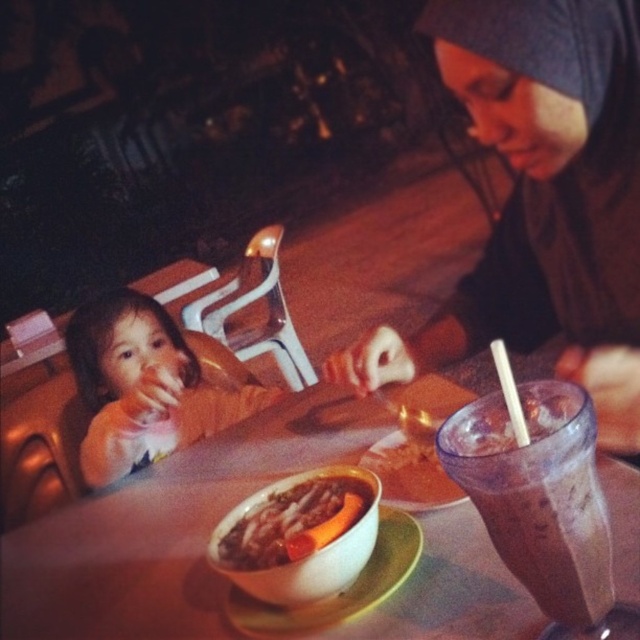
Image resolution: width=640 pixels, height=640 pixels. I want to click on chocolate milkshake at right, so 538,493.

Who is positioned more to the left, chocolate milkshake at right or smooth orange carrot at center?

smooth orange carrot at center is more to the left.

At what (x,y) coordinates should I click in order to perform the action: click on chocolate milkshake at right. Please return your answer as a coordinate pair (x, y). Looking at the image, I should click on (538, 493).

Can you confirm if smooth wooden table at center is taller than chocolate milkshake at right?

Correct, smooth wooden table at center is much taller as chocolate milkshake at right.

Does smooth wooden table at center appear over chocolate milkshake at right?

Incorrect, smooth wooden table at center is not positioned above chocolate milkshake at right.

You are a GUI agent. You are given a task and a screenshot of the screen. Output one action in this format:
    pyautogui.click(x=<x>, y=<y>)
    Task: Click on the smooth wooden table at center
    
    Given the screenshot: What is the action you would take?
    pyautogui.click(x=168, y=529)

Where is `smooth wooden table at center`? smooth wooden table at center is located at coordinates (168, 529).

Does chocolate milkshake at right appear on the right side of smooth beige shirt at left?

Yes, chocolate milkshake at right is to the right of smooth beige shirt at left.

Describe the element at coordinates (538, 493) in the screenshot. I see `chocolate milkshake at right` at that location.

I want to click on chocolate milkshake at right, so click(x=538, y=493).

I want to click on chocolate milkshake at right, so click(538, 493).